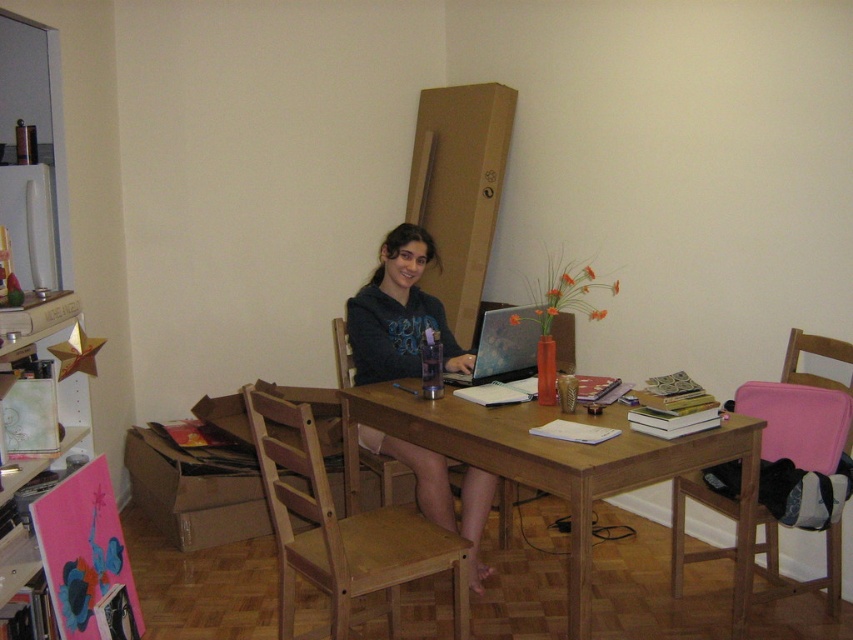
Question: Which object appears farthest from the camera in this image?

Choices:
 (A) light wood chair at center
 (B) wooden chair at center

Answer: (B)

Question: Which point is closer to the camera?

Choices:
 (A) click(x=392, y=435)
 (B) click(x=352, y=595)
 (C) click(x=805, y=420)
 (D) click(x=358, y=305)

Answer: (B)

Question: Does wooden table at center have a greater width compared to pink fabric chair at right?

Choices:
 (A) no
 (B) yes

Answer: (B)

Question: Where is pink fabric chair at right located in relation to wooden chair at center in the image?

Choices:
 (A) left
 (B) right

Answer: (B)

Question: Among these objects, which one is farthest from the camera?

Choices:
 (A) matte black hoodie at center
 (B) pink fabric chair at right
 (C) wooden chair at center

Answer: (C)

Question: Does wooden table at center appear under pink fabric chair at right?

Choices:
 (A) yes
 (B) no

Answer: (B)